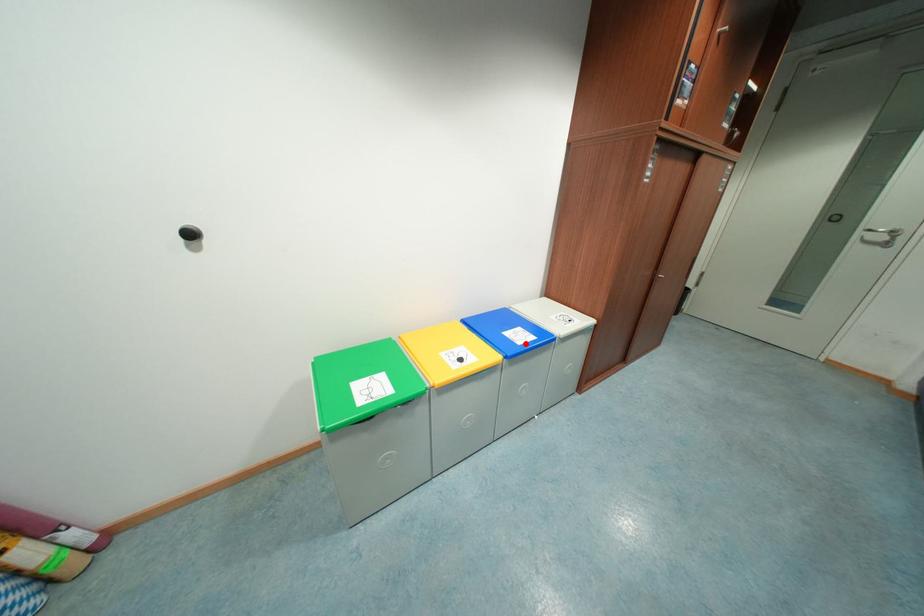
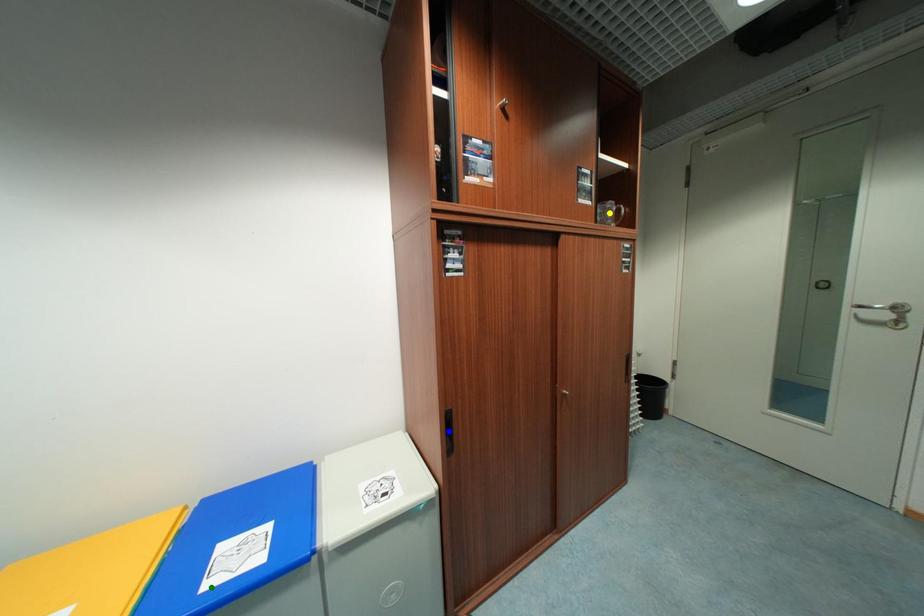
Question: I am providing you with two images of the same scene from different viewpoints. A red point is marked on the first image. You are given multiple points on the second image. In image 2, which mark is for the same physical point as the one in image 1?

Choices:
 (A) green point
 (B) blue point
 (C) yellow point

Answer: (A)